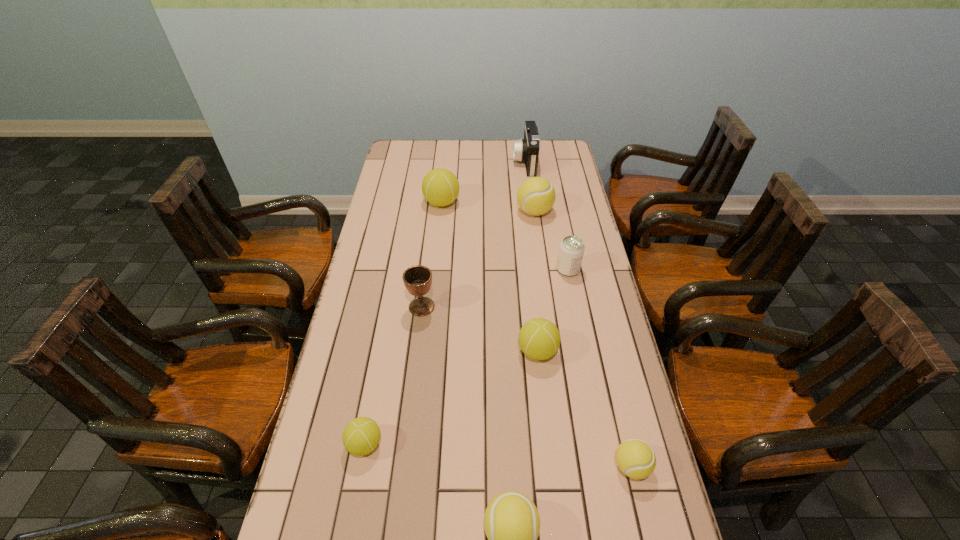
Identify the location of the farthest object. (527, 149).

Locate an element on the screen. This screenshot has height=540, width=960. camcorder is located at coordinates (527, 149).

At what (x,y) coordinates should I click in order to perform the action: click on the second yellow tennis ball from left to right. Please return your answer as a coordinate pair (x, y). Looking at the image, I should click on click(x=536, y=196).

Locate an element on the screen. the farthest yellow tennis ball is located at coordinates (536, 196).

You are a GUI agent. You are given a task and a screenshot of the screen. Output one action in this format:
    pyautogui.click(x=<x>, y=<y>)
    Task: Click on the biggest green tennis ball
    
    Given the screenshot: What is the action you would take?
    pyautogui.click(x=440, y=187)

The width and height of the screenshot is (960, 540). I want to click on the second tennis ball from left to right, so click(x=440, y=187).

At what (x,y) coordinates should I click in order to perform the action: click on the fifth nearest object. Please return your answer as a coordinate pair (x, y). This screenshot has height=540, width=960. Looking at the image, I should click on (417, 279).

You are a GUI agent. You are given a task and a screenshot of the screen. Output one action in this format:
    pyautogui.click(x=<x>, y=<y>)
    Task: Click on the sixth nearest object
    
    Given the screenshot: What is the action you would take?
    pyautogui.click(x=571, y=250)

Locate an element on the screen. the sixth farthest object is located at coordinates (539, 339).

This screenshot has height=540, width=960. What are the coordinates of `the second farthest green tennis ball` in the screenshot? It's located at click(539, 339).